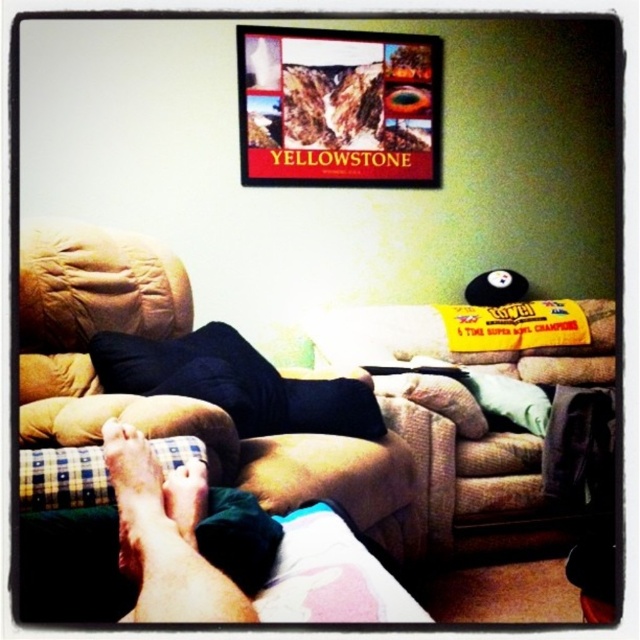
Question: Is brown fabric armchair at lower left to the left of smooth skin foot at lower left from the viewer's perspective?

Choices:
 (A) yes
 (B) no

Answer: (A)

Question: Is brown fabric couch at center smaller than wooden yellowstone poster at upper center?

Choices:
 (A) no
 (B) yes

Answer: (A)

Question: Which is farther from the dry skin at lower left?

Choices:
 (A) smooth skin feet at lower left
 (B) smooth skin foot at lower left

Answer: (A)

Question: Is wooden yellowstone poster at upper center positioned at the back of dry skin at lower left?

Choices:
 (A) yes
 (B) no

Answer: (A)

Question: Which of these objects is positioned closest to the smooth skin foot at lower left?

Choices:
 (A) dry skin at lower left
 (B) brown fabric armchair at lower left

Answer: (A)

Question: Among these objects, which one is farthest from the camera?

Choices:
 (A) dry skin at lower left
 (B) wooden yellowstone poster at upper center
 (C) brown fabric couch at center

Answer: (B)